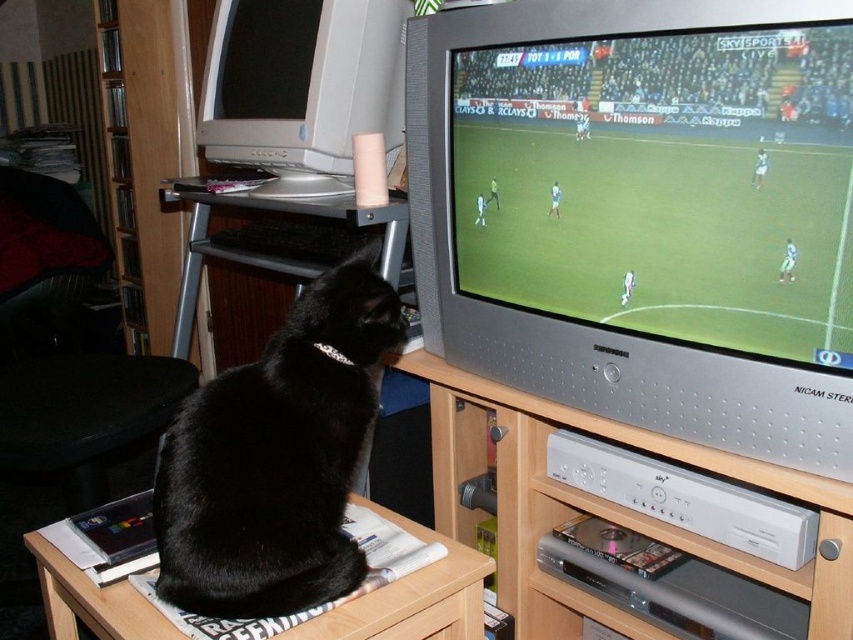
You are standing in the living room and want to place a new DVD player on the wooden entertainment center at lower center. The entertainment center has a coordinate system where the bottom left corner is the origin. The point you need to place the DVD player is at coordinates (601, 506). Is this point on the wooden entertainment center at lower center?

Yes, the point at coordinates (601, 506) marks the wooden entertainment center at lower center, so placing the DVD player there would be correct.

You are a small robot with a width of 16 inches. You need to move from the black fur cat at lower left to the wooden entertainment center at lower center. Can you fit through the space between them?

The black fur cat at lower left is 16.76 inches away from the wooden entertainment center at lower center. Since the robot is 16 inches wide, it can fit through the space between them as the distance is slightly larger than the robot.

You are a guest in the living room and see the black fur cat at lower left and the wooden table at lower left. Which object is closer to the right side of the room?

The black fur cat at lower left is closer to the right side of the room because it is positioned to the right of the wooden table at lower left.